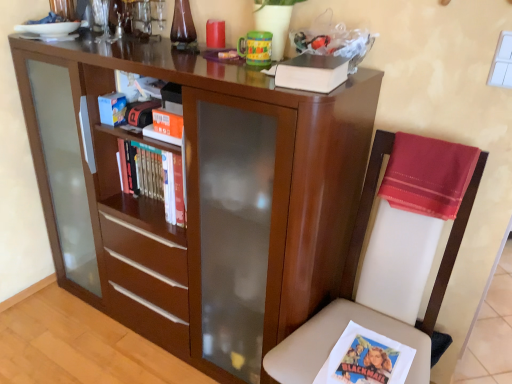
Question: Is white leather chair at right shorter than matte wood bookcase at center?

Choices:
 (A) yes
 (B) no

Answer: (A)

Question: From a real-world perspective, is white leather chair at right located beneath matte wood bookcase at center?

Choices:
 (A) yes
 (B) no

Answer: (A)

Question: Is white leather chair at right turned away from matte wood bookcase at center?

Choices:
 (A) no
 (B) yes

Answer: (A)

Question: Considering the relative sizes of white leather chair at right and matte wood bookcase at center in the image provided, is white leather chair at right wider than matte wood bookcase at center?

Choices:
 (A) no
 (B) yes

Answer: (B)

Question: Can you confirm if white leather chair at right is taller than matte wood bookcase at center?

Choices:
 (A) yes
 (B) no

Answer: (B)

Question: Would you say hardcover book at upper center is inside or outside white leather chair at right?

Choices:
 (A) outside
 (B) inside

Answer: (A)

Question: Would you say hardcover book at upper center is to the left or to the right of white leather chair at right in the picture?

Choices:
 (A) left
 (B) right

Answer: (A)

Question: Is hardcover book at upper center in front of or behind white leather chair at right in the image?

Choices:
 (A) front
 (B) behind

Answer: (B)

Question: From a real-world perspective, is hardcover book at upper center above or below white leather chair at right?

Choices:
 (A) above
 (B) below

Answer: (A)

Question: Is white leather chair at right wider or thinner than silky red cloth at right?

Choices:
 (A) wide
 (B) thin

Answer: (A)

Question: From the image's perspective, is white leather chair at right located above or below silky red cloth at right?

Choices:
 (A) below
 (B) above

Answer: (A)

Question: Which is correct: white leather chair at right is inside silky red cloth at right, or outside of it?

Choices:
 (A) inside
 (B) outside

Answer: (B)

Question: Considering the positions of white leather chair at right and silky red cloth at right in the image, is white leather chair at right taller or shorter than silky red cloth at right?

Choices:
 (A) short
 (B) tall

Answer: (B)

Question: Is silky red cloth at right spatially inside white leather chair at right, or outside of it?

Choices:
 (A) outside
 (B) inside

Answer: (B)

Question: Looking at their shapes, would you say silky red cloth at right is wider or thinner than white leather chair at right?

Choices:
 (A) thin
 (B) wide

Answer: (A)